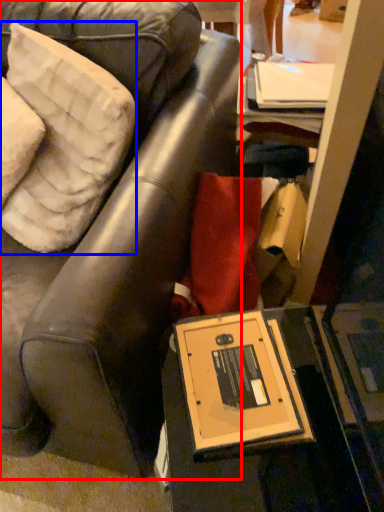
Question: Which object appears farthest to the camera in this image, chair (highlighted by a red box) or pillow (highlighted by a blue box)?

Choices:
 (A) chair
 (B) pillow

Answer: (B)